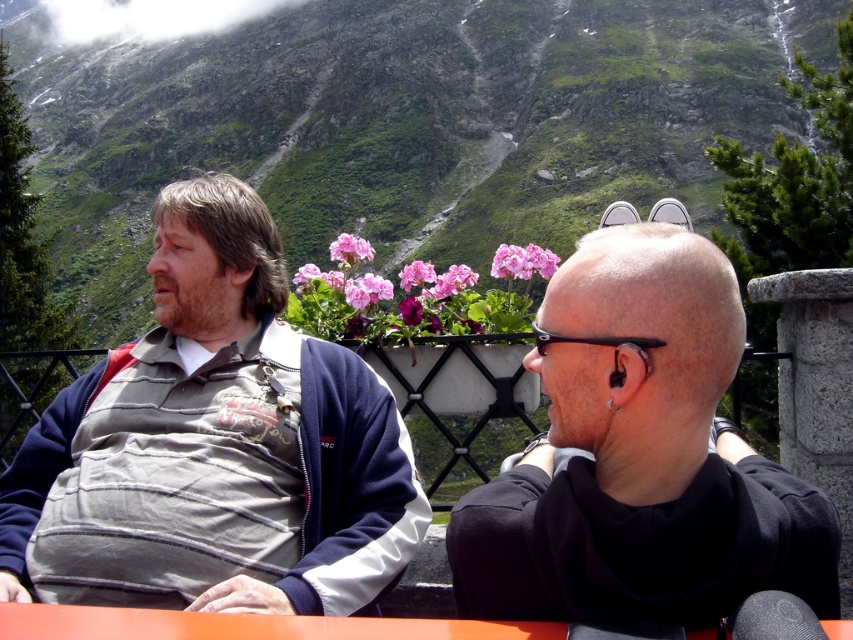
Is the position of gray striped shirt at left more distant than that of black matte hair at center?

Yes.

Locate an element on the screen. gray striped shirt at left is located at coordinates (213, 445).